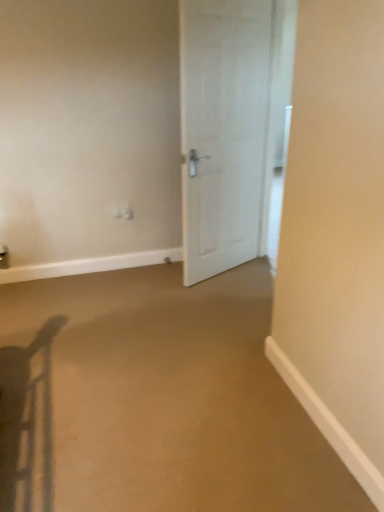
Where is `unoccupied area in front of white matte door at center`? The image size is (384, 512). unoccupied area in front of white matte door at center is located at coordinates (231, 294).